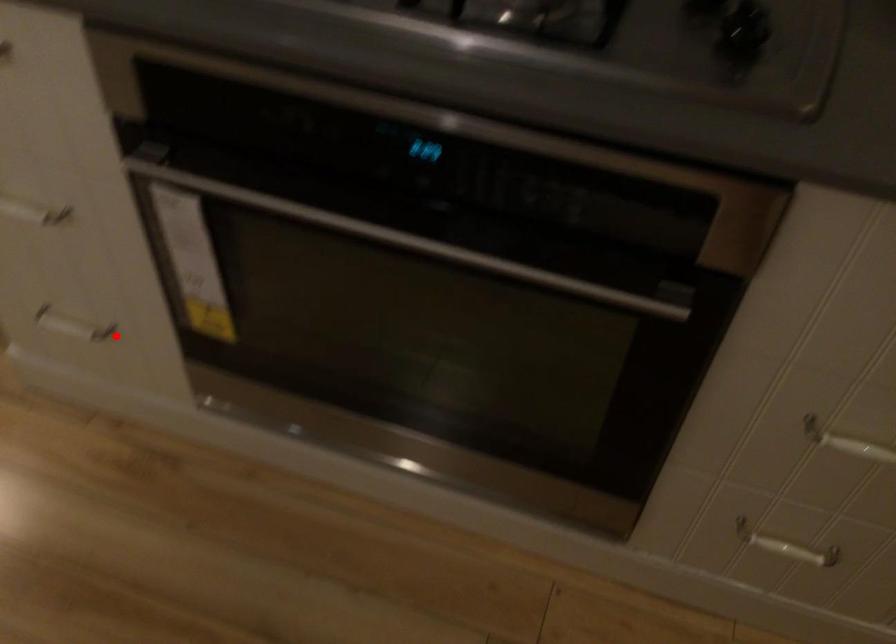
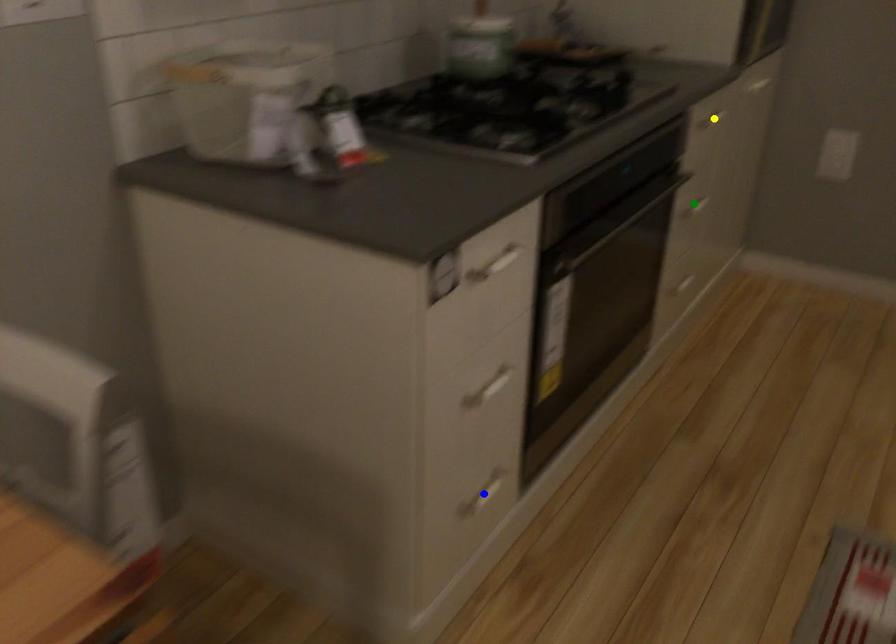
Question: I am providing you with two images of the same scene from different viewpoints. A red point is marked on the first image. You are given multiple points on the second image. In image 2, which mark is for the same physical point as the one in image 1?

Choices:
 (A) yellow point
 (B) blue point
 (C) green point

Answer: (B)